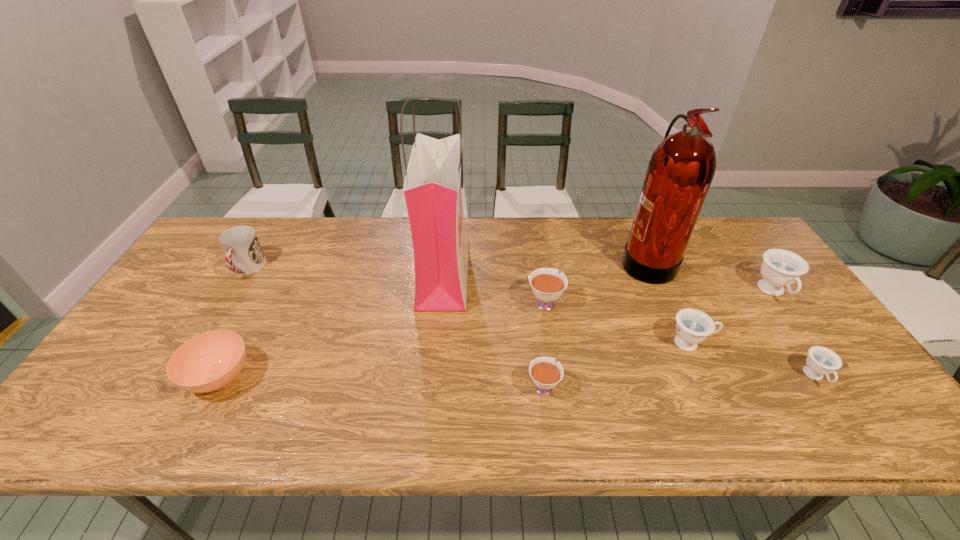
Where is `empty space that is in between the nearer white teacup and the shopping bag`? empty space that is in between the nearer white teacup and the shopping bag is located at coordinates (493, 328).

I want to click on empty space between the red fire extinguisher and the nearer white teacup, so click(594, 323).

You are a GUI agent. You are given a task and a screenshot of the screen. Output one action in this format:
    pyautogui.click(x=<x>, y=<y>)
    Task: Click on the free space that is in between the nearer white teacup and the smallest blue teacup
    The image size is (960, 540).
    Given the screenshot: What is the action you would take?
    pos(679,381)

At what (x,y) coordinates should I click in order to perform the action: click on vacant space that's between the third object from left to right and the bigger white teacup. Please return your answer as a coordinate pair (x, y). The image size is (960, 540). Looking at the image, I should click on (494, 287).

The height and width of the screenshot is (540, 960). I want to click on free spot between the nearer white teacup and the biggest blue teacup, so click(659, 339).

The image size is (960, 540). In order to click on the fourth closest object to the third nearest teacup in this screenshot , I will do `click(547, 284)`.

I want to click on object that is the fifth closest one to the bigger white teacup, so click(821, 361).

The height and width of the screenshot is (540, 960). What are the coordinates of `teacup that is the closest to the bigger white teacup` in the screenshot? It's located at (545, 372).

Where is `the second closest teacup to the third object from left to right`? Image resolution: width=960 pixels, height=540 pixels. the second closest teacup to the third object from left to right is located at coordinates (545, 372).

This screenshot has width=960, height=540. I want to click on blue teacup object that ranks as the third closest to the bigger white teacup, so click(781, 268).